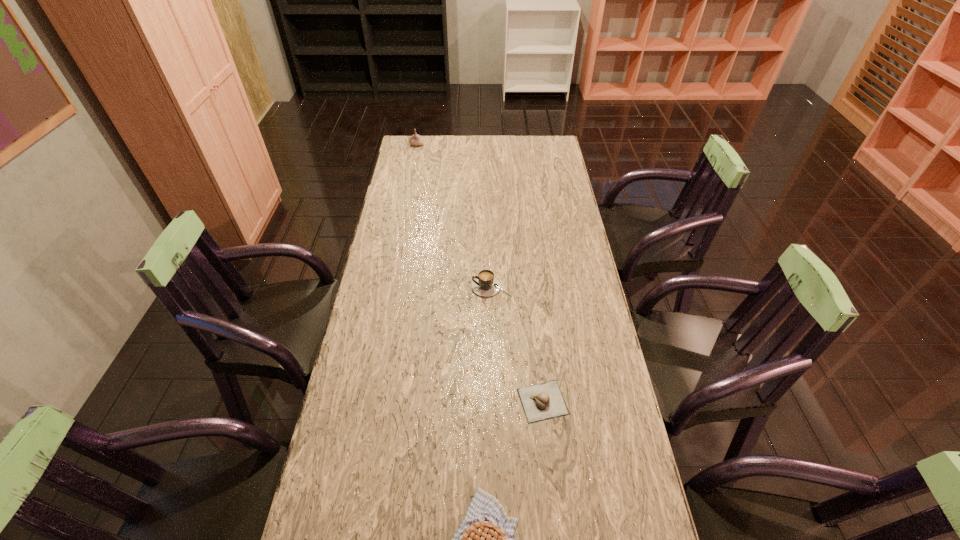
This screenshot has height=540, width=960. Identify the location of free space located 0.230m on the front of the shorter garlic. (556, 521).

Identify the location of object at the far edge. click(x=415, y=139).

Where is `object at the left edge`? object at the left edge is located at coordinates (415, 139).

In order to click on object positioned at the right edge in this screenshot , I will do `click(544, 401)`.

I want to click on object that is at the far left corner, so click(415, 139).

In the image, there is a desktop. Identify the location of blank space at the far edge. This screenshot has height=540, width=960. (456, 137).

Where is `vacant space at the left edge of the desktop`? Image resolution: width=960 pixels, height=540 pixels. vacant space at the left edge of the desktop is located at coordinates (394, 195).

Image resolution: width=960 pixels, height=540 pixels. I want to click on free region at the right edge of the desktop, so click(585, 299).

This screenshot has height=540, width=960. In order to click on vacant space at the far left corner in this screenshot , I will do click(405, 136).

The width and height of the screenshot is (960, 540). What are the coordinates of `vacant space at the far right corner of the desktop` in the screenshot? It's located at (539, 143).